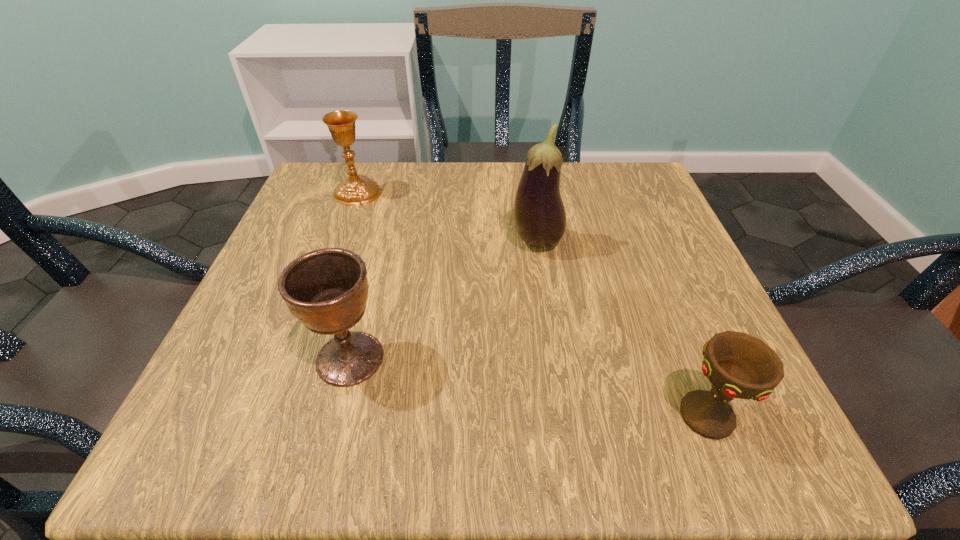
Find the location of `object situated at the right edge`. object situated at the right edge is located at coordinates (738, 365).

In order to click on object located at the far left corner in this screenshot , I will do `click(357, 190)`.

Identify the location of object present at the near right corner. (738, 365).

Locate an element on the screen. The height and width of the screenshot is (540, 960). free space at the far edge is located at coordinates (385, 198).

Locate an element on the screen. vacant space at the near edge of the desktop is located at coordinates (477, 447).

Where is `free point at the left edge`? This screenshot has width=960, height=540. free point at the left edge is located at coordinates (326, 232).

Identify the location of blank area at the right edge. (618, 248).

This screenshot has width=960, height=540. In order to click on free spot at the far right corner of the desktop in this screenshot , I will do `click(602, 219)`.

Image resolution: width=960 pixels, height=540 pixels. In the image, there is a desktop. Find the location of `free space at the near right corner`. free space at the near right corner is located at coordinates (709, 446).

I want to click on vacant space in between the third object from left to right and the rightmost chalice, so click(x=621, y=329).